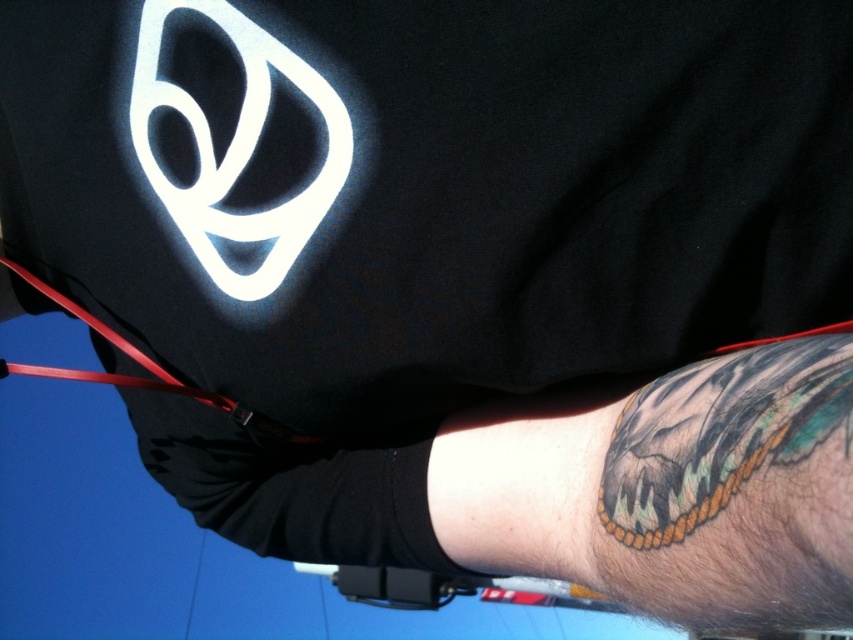
You are a tailor measuring a customer for a custom shirt. You notice the black matte shirt at center and the rubber strap at lower left in the image. Which item is significantly taller in the scene?

The black matte shirt at center is much taller as the rubber strap at lower left, so the black matte shirt at center is significantly taller in the scene.

You are a security guard checking the identity of a person. You need to verify their tattoo location. According to the image, where exactly is the black tattooed skin at lower right located?

The black tattooed skin at lower right is located at point [601,492].

Based on the photo, you are a fashion designer observing the image. You need to decide which item has a greater width between the black matte shirt at center and the black tattooed skin at lower right. Which one is wider?

The black matte shirt at center is wider than the black tattooed skin at lower right according to the description.